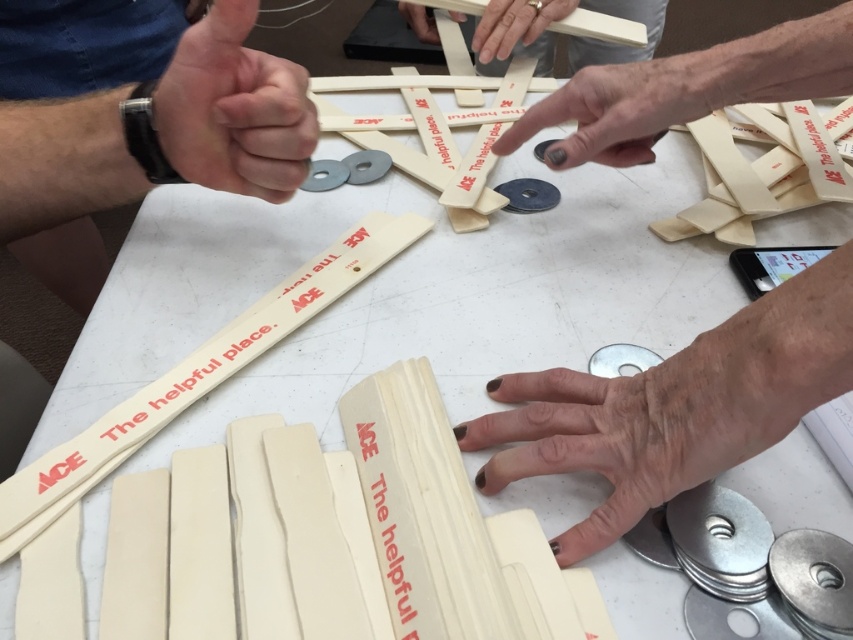
Question: Is nail-polished skin at center wider than white matte wood at upper center?

Choices:
 (A) yes
 (B) no

Answer: (A)

Question: Which point is closer to the camera?

Choices:
 (A) (109, 125)
 (B) (682, 108)
 (C) (419, 29)

Answer: (A)

Question: Is matte white finger at upper center above matte wood stick at upper center?

Choices:
 (A) yes
 (B) no

Answer: (B)

Question: Which point is farther to the camera?

Choices:
 (A) (227, 90)
 (B) (476, 24)
 (C) (421, 28)
 (D) (544, 451)

Answer: (B)

Question: Estimate the real-world distances between objects in this image. Which object is closer to the white matte wood at upper center?

Choices:
 (A) nail-polished skin at center
 (B) matte wood stick at upper center

Answer: (B)

Question: Can you confirm if nail-polished skin at center is wider than matte wood stick at upper center?

Choices:
 (A) no
 (B) yes

Answer: (A)